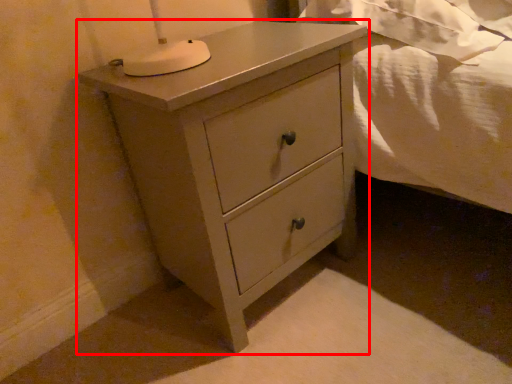
Question: In this image, where is chest of drawers (annotated by the red box) located relative to sheet?

Choices:
 (A) right
 (B) left

Answer: (B)